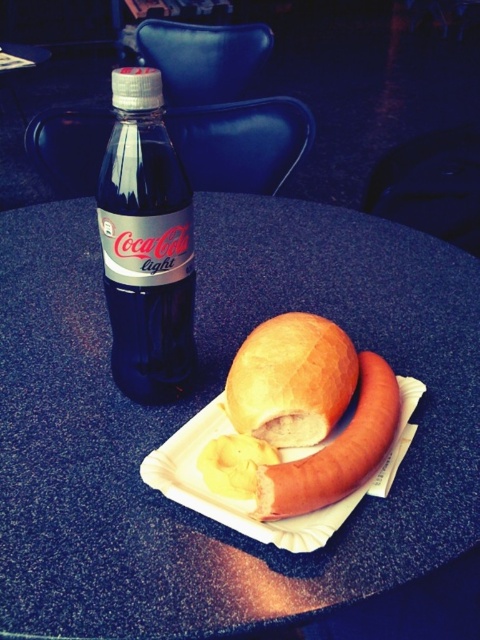
Is the position of blue glass bottle at left less distant than that of golden matte roll at center?

That is True.

Between point (157, 298) and point (253, 396), which one is positioned behind?

The point (157, 298) is more distant.

This screenshot has width=480, height=640. In order to click on blue glass bottle at left in this screenshot , I will do `click(145, 244)`.

Looking at this image, who is positioned more to the left, white paper plate at center or yellowish matte potato at center?

Positioned to the left is yellowish matte potato at center.

Locate an element on the screen. Image resolution: width=480 pixels, height=640 pixels. white paper plate at center is located at coordinates (252, 499).

Can you confirm if golden matte roll at center is wider than yellowish matte potato at center?

Correct, the width of golden matte roll at center exceeds that of yellowish matte potato at center.

Is golden matte roll at center closer to camera compared to yellowish matte potato at center?

No.

Between point (305, 406) and point (242, 499), which one is positioned behind?

Point (305, 406)

Where is `golden matte roll at center`? golden matte roll at center is located at coordinates (290, 380).